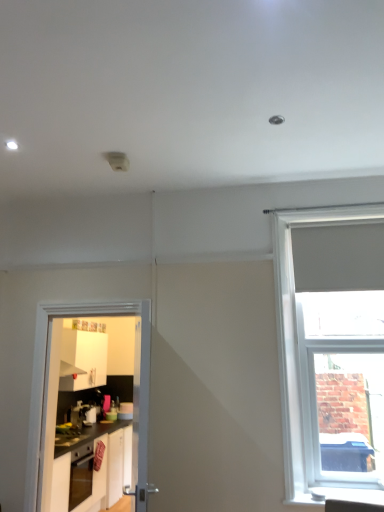
The height and width of the screenshot is (512, 384). Identify the location of white matte window at right. (296, 330).

Find the location of a particular element. This screenshot has height=512, width=384. satin silver coffee machine at left is located at coordinates (83, 414).

This screenshot has width=384, height=512. Describe the element at coordinates (83, 414) in the screenshot. I see `satin silver coffee machine at left` at that location.

You are a GUI agent. You are given a task and a screenshot of the screen. Output one action in this format:
    pyautogui.click(x=<x>, y=<y>)
    Task: Click on the white glossy cabinets at lower left
    This screenshot has width=384, height=512.
    Given the screenshot: What is the action you would take?
    pyautogui.click(x=93, y=470)

What is the approximate height of white glossy door at left?

The height of white glossy door at left is 5.08 feet.

In order to face white smooth window sill at lower right, should I rotate leftwards or rightwards?

Rotate your view right by about 18.295°.

This screenshot has width=384, height=512. I want to click on white matte window at right, so click(296, 330).

Does point (349, 211) come behind point (47, 305)?

No, it is in front of (47, 305).

Is white matte window at right with white glossy door at left?

white matte window at right is not next to white glossy door at left, and they're not touching.

Who is smaller, white matte window at right or white glossy door at left?

With smaller size is white glossy door at left.

Can you tell me how much white smooth window sill at lower right and white glossy door at left differ in facing direction?

0.0547 degrees separate the facing orientations of white smooth window sill at lower right and white glossy door at left.

Measure the distance from white smooth window sill at lower right to white glossy door at left.

They are 6.06 feet apart.

Consider the image. Considering the sizes of white smooth window sill at lower right and white glossy door at left in the image, is white smooth window sill at lower right wider or thinner than white glossy door at left?

In the image, white smooth window sill at lower right appears to be wider than white glossy door at left.

Between point (373, 489) and point (49, 366), which one is positioned in front?

The point (373, 489) is in front.

Does white matte window at right have a greater height compared to white glossy cabinets at lower left?

Indeed, white matte window at right has a greater height compared to white glossy cabinets at lower left.

Is white matte window at right to the left of white glossy cabinets at lower left from the viewer's perspective?

Incorrect, white matte window at right is not on the left side of white glossy cabinets at lower left.

From a real-world perspective, who is located higher, white matte window at right or white glossy cabinets at lower left?

white matte window at right.

Is white glossy cabinets at lower left at the back of white matte window at right?

No.

Is white matte window at right positioned behind satin silver coffee machine at left?

No, white matte window at right is in front of satin silver coffee machine at left.

From a real-world perspective, which is physically above, white matte window at right or satin silver coffee machine at left?

white matte window at right, from a real-world perspective.

In order to click on coffee machine lying behind the white matte window at right in this screenshot , I will do `click(83, 414)`.

In terms of height, does white glossy door at left look taller or shorter compared to white matte window at right?

white glossy door at left is shorter than white matte window at right.

Is white glossy door at left oriented away from white matte window at right?

No.

From the image's perspective, between white glossy door at left and white matte window at right, who is located below?

white glossy door at left.

From the picture: Is satin silver coffee machine at left next to white matte window at right?

satin silver coffee machine at left is not next to white matte window at right, and they're not touching.

Is satin silver coffee machine at left taller or shorter than white matte window at right?

Considering their sizes, satin silver coffee machine at left has less height than white matte window at right.

Is satin silver coffee machine at left oriented away from white matte window at right?

No, satin silver coffee machine at left's orientation is not away from white matte window at right.

From the image's perspective, is white glossy door at left under white smooth window sill at lower right?

Incorrect, from the image's perspective, white glossy door at left is higher than white smooth window sill at lower right.

Considering the points (45, 409) and (307, 499), which point is in front, point (45, 409) or point (307, 499)?

The point (307, 499) is closer.

From a real-world perspective, is white glossy door at left positioned under white smooth window sill at lower right based on gravity?

No, from a real-world perspective, white glossy door at left is not under white smooth window sill at lower right.

This screenshot has width=384, height=512. In the image, there is a white glossy door at left. In order to click on window above it (from the image's perspective) in this screenshot , I will do `click(296, 330)`.

I want to click on window sill below the white glossy door at left (from a real-world perspective), so click(344, 495).

Based on their spatial positions, is white matte window at right or white glossy cabinets at lower left closer to white glossy door at left?

Based on the image, white glossy cabinets at lower left appears to be nearer to white glossy door at left.

Looking at the image, which one is located further to white smooth window sill at lower right, white glossy door at left or satin silver coffee machine at left?

Among the two, satin silver coffee machine at left is located further to white smooth window sill at lower right.

From the image, which object appears to be farther from satin silver coffee machine at left, white matte window at right or white glossy cabinets at lower left?

The object further to satin silver coffee machine at left is white matte window at right.

Looking at the image, which one is located closer to white glossy door at left, white glossy cabinets at lower left or white matte window at right?

white glossy cabinets at lower left lies closer to white glossy door at left than the other object.

Based on the photo, from the image, which object appears to be nearer to white matte window at right, white glossy cabinets at lower left or white glossy door at left?

Based on the image, white glossy door at left appears to be nearer to white matte window at right.

Based on their spatial positions, is white matte window at right or white glossy door at left further from satin silver coffee machine at left?

white matte window at right lies further to satin silver coffee machine at left than the other object.

When comparing their distances from white smooth window sill at lower right, does white glossy door at left or white matte window at right seem closer?

white matte window at right is closer to white smooth window sill at lower right.

Based on their spatial positions, is white smooth window sill at lower right or satin silver coffee machine at left further from white glossy cabinets at lower left?

Among the two, white smooth window sill at lower right is located further to white glossy cabinets at lower left.

Locate an element on the screen. cabinetry located between white glossy door at left and satin silver coffee machine at left in the depth direction is located at coordinates (93, 470).

At what (x,y) coordinates should I click in order to perform the action: click on door located between white smooth window sill at lower right and white glossy cabinets at lower left in the depth direction. Please return your answer as a coordinate pair (x, y). The height and width of the screenshot is (512, 384). Looking at the image, I should click on (48, 383).

Locate an element on the screen. The height and width of the screenshot is (512, 384). window sill between white matte window at right and satin silver coffee machine at left in the front-back direction is located at coordinates (344, 495).

Where is `door positioned between white smooth window sill at lower right and satin silver coffee machine at left from near to far`? The image size is (384, 512). door positioned between white smooth window sill at lower right and satin silver coffee machine at left from near to far is located at coordinates (48, 383).